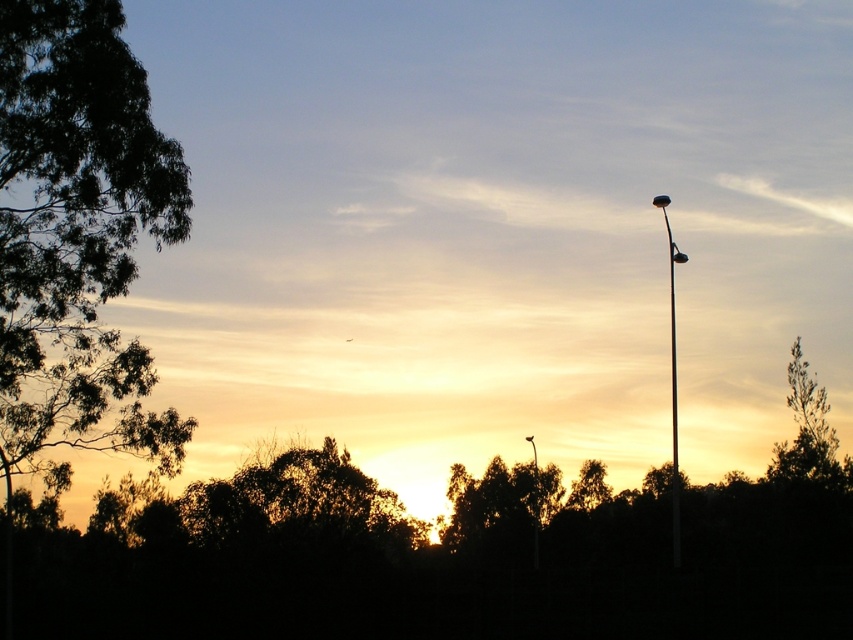
You are standing in the middle of the image and want to walk towards the green leafy tree at left. In which direction should you move?

You should move towards the left direction to reach the green leafy tree at left since it is located at the left side of the image.

You are an observer looking at the sunset scene. You notice the green leafy tree at left and the green leafy tree at right. Which tree appears higher in the image?

The green leafy tree at left appears higher in the image than the green leafy tree at right because it is positioned above it.